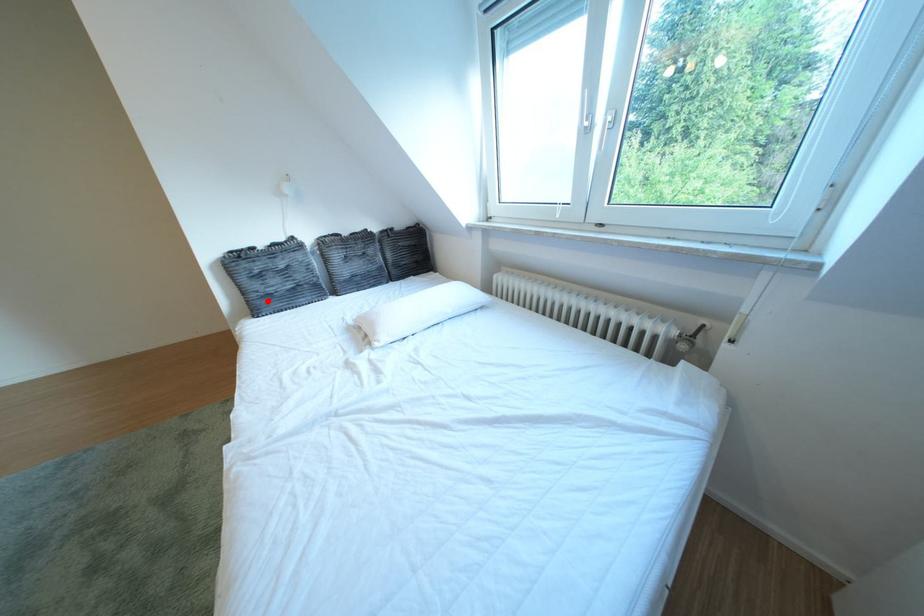
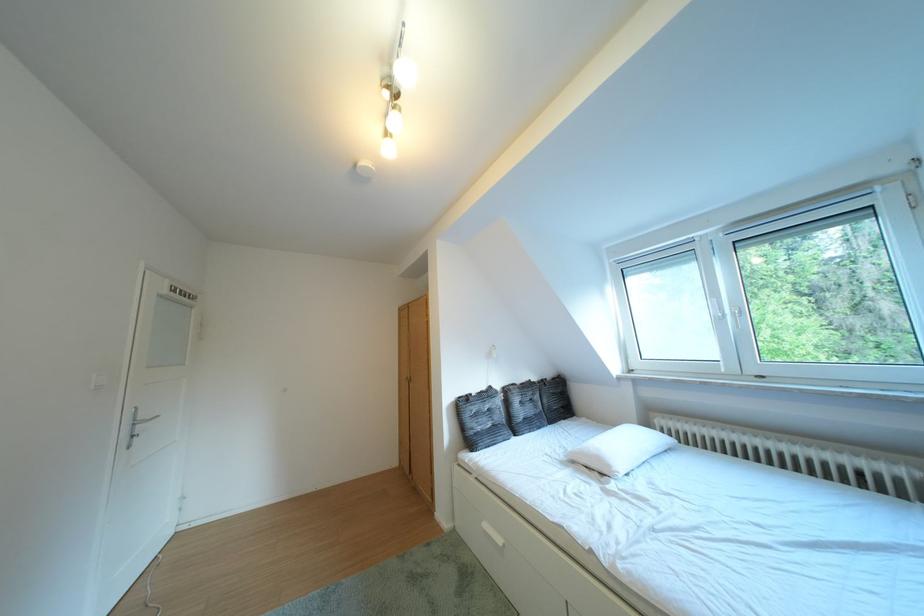
Where in the second image is the point corresponding to the highlighted location from the first image?

(484, 438)